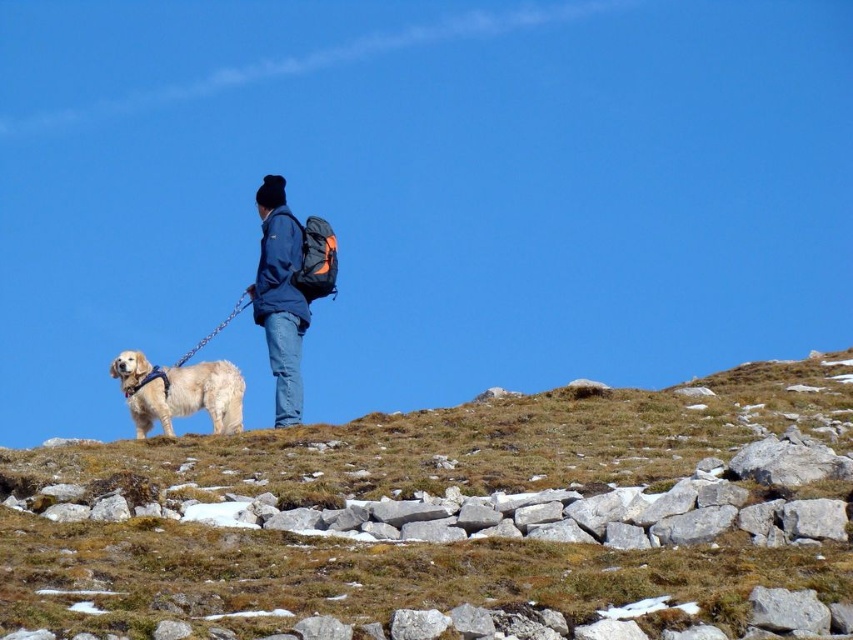
Who is higher up, brown grassy hillside at lower center or golden fur dog at left?

brown grassy hillside at lower center is higher up.

Is brown grassy hillside at lower center smaller than golden fur dog at left?

No, brown grassy hillside at lower center is not smaller than golden fur dog at left.

This screenshot has height=640, width=853. Find the location of `brown grassy hillside at lower center`. brown grassy hillside at lower center is located at coordinates (451, 518).

I want to click on brown grassy hillside at lower center, so click(x=451, y=518).

Which is in front, point (49, 467) or point (273, 221)?

Positioned in front is point (49, 467).

Can you confirm if brown grassy hillside at lower center is bigger than blue denim jacket at center?

Actually, brown grassy hillside at lower center might be smaller than blue denim jacket at center.

What do you see at coordinates (451, 518) in the screenshot?
I see `brown grassy hillside at lower center` at bounding box center [451, 518].

The height and width of the screenshot is (640, 853). I want to click on brown grassy hillside at lower center, so click(x=451, y=518).

Is blue denim jacket at center below golden fur dog at left?

No.

Which is more to the right, blue denim jacket at center or golden fur dog at left?

golden fur dog at left

The width and height of the screenshot is (853, 640). Find the location of `blue denim jacket at center`. blue denim jacket at center is located at coordinates click(280, 298).

The width and height of the screenshot is (853, 640). Find the location of `blue denim jacket at center`. blue denim jacket at center is located at coordinates (280, 298).